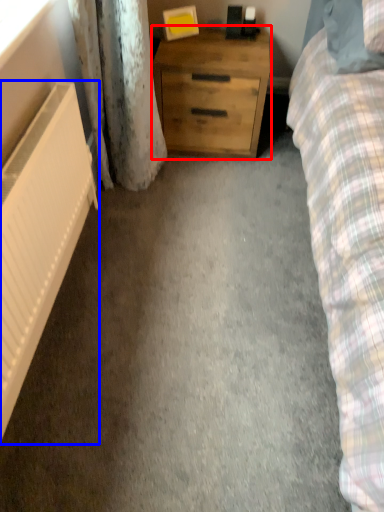
Question: Which point is closer to the camera, chest of drawers (highlighted by a red box) or radiator (highlighted by a blue box)?

Choices:
 (A) chest of drawers
 (B) radiator

Answer: (B)